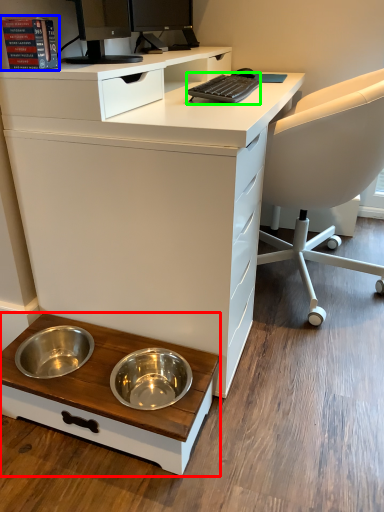
Question: Based on their relative distances, which object is nearer to table (highlighted by a red box)? Choose from book (highlighted by a blue box) and computer keyboard (highlighted by a green box).

Choices:
 (A) book
 (B) computer keyboard

Answer: (A)